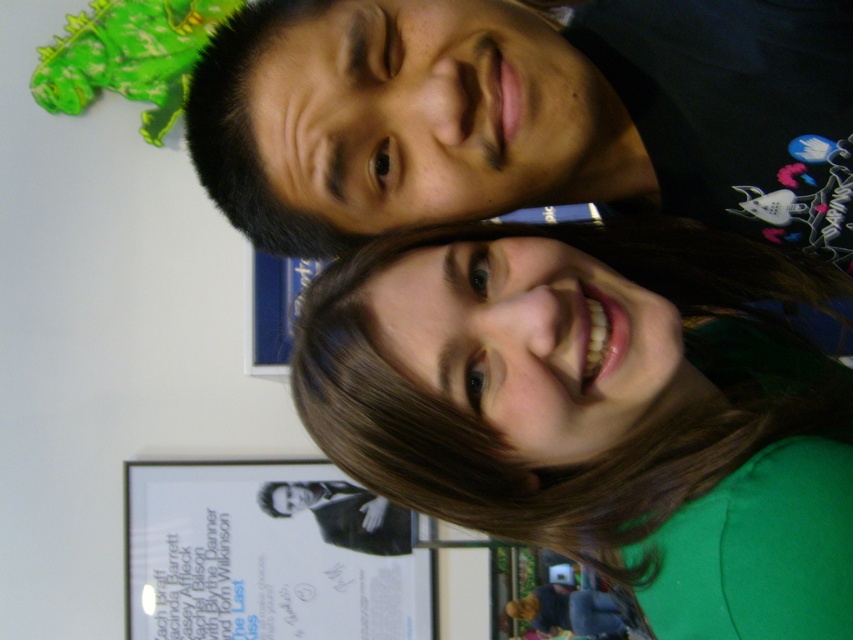
You are an interior designer observing the scene. You need to place a decorative item between the green matte shirt at lower right and the matte black shirt at upper center. Based on their positions, where should you place the item to ensure it is equidistant from both shirts?

The green matte shirt at lower right is to the right of the matte black shirt at upper center. To place the decorative item equidistant between them, position it along the line connecting their centers, closer to the center of the image since the green shirt is further right.

You are standing in the room where the image was taken. You see a point at coordinates (599,410). What object is located at that point?

The point at coordinates (599,410) corresponds to the green matte shirt at lower right.

You are a photographer adjusting your camera settings to capture a clear shot of the green matte shirt at lower right. Based on the scene, what is the approximate distance you need to focus on to ensure the shirt is in sharp focus?

The green matte shirt at lower right is approximately 69.52 centimeters away from the viewer, so the photographer should focus the camera at that distance to ensure sharpness.